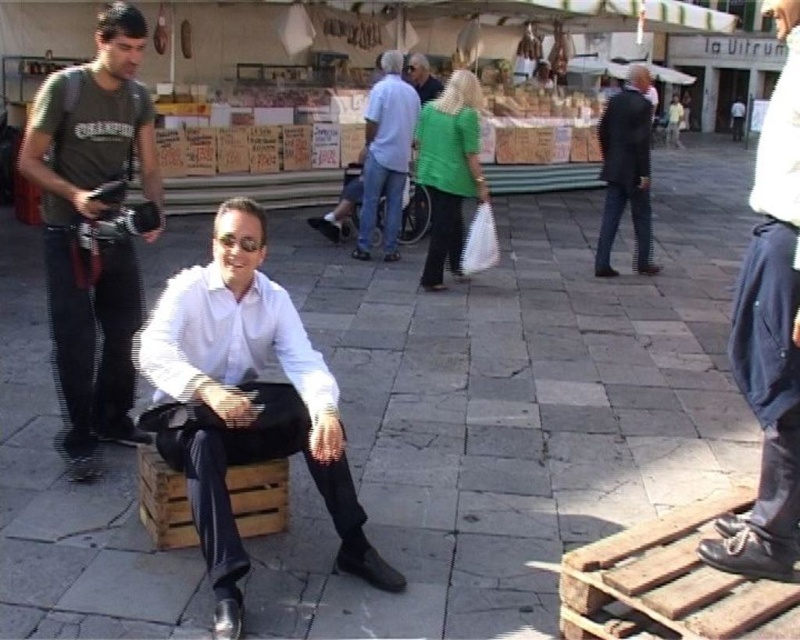
Can you confirm if light blue denim jeans at center is taller than matte green sweater at center?

Yes.

Is light blue denim jeans at center wider than matte green sweater at center?

Correct, the width of light blue denim jeans at center exceeds that of matte green sweater at center.

Between point (368, 212) and point (436, 86), which one is positioned behind?

The point (436, 86) is behind.

Image resolution: width=800 pixels, height=640 pixels. I want to click on light blue denim jeans at center, so click(385, 154).

Between dark blue jeans at lower right and green matte jacket at center, which one has more height?

dark blue jeans at lower right is taller.

Which is behind, point (796, 337) or point (472, 113)?

Point (472, 113)

Where is `dark blue jeans at lower right`? dark blue jeans at lower right is located at coordinates point(770,333).

Can you confirm if white matte shirt at center is shorter than dark blue jeans at lower right?

Yes.

Can you confirm if white matte shirt at center is smaller than dark blue jeans at lower right?

Correct, white matte shirt at center occupies less space than dark blue jeans at lower right.

I want to click on white matte shirt at center, so click(244, 403).

Locate an element on the screen. This screenshot has width=800, height=640. white matte shirt at center is located at coordinates click(x=244, y=403).